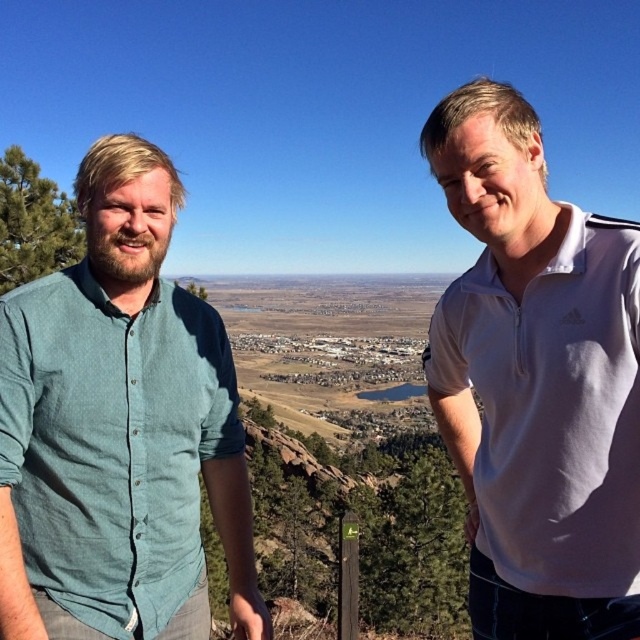
You are a photographer positioned at the camera location. You want to capture a closeup shot of the teal cotton shirt at left without moving the subject. Can you estimate if the shirt is within the standard 150 feet autofocus range of your camera?

The teal cotton shirt at left is 148.35 feet away from camera, which is within the standard 150 feet autofocus range. Therefore, the photographer can capture a closeup shot without moving the subject.

You are a fashion designer observing two people in the scene. You need to decide which garment to recommend for a client who prefers a more compact and streamlined look. Which item would you suggest between the teal cotton shirt at left and the white cotton polo shirt at right?

The teal cotton shirt at left has a smaller size compared to the white cotton polo shirt at right, so it would be the better recommendation for a more compact and streamlined look.

You are a photographer trying to capture a landscape photo of the city below. You are standing between the teal cotton shirt at left and the white cotton polo shirt at right. Which person should you move closer to in order to frame the cityscape better?

You should move closer to the teal cotton shirt at left since it is in front of the white cotton polo shirt at right, allowing for a clearer view of the cityscape behind them.